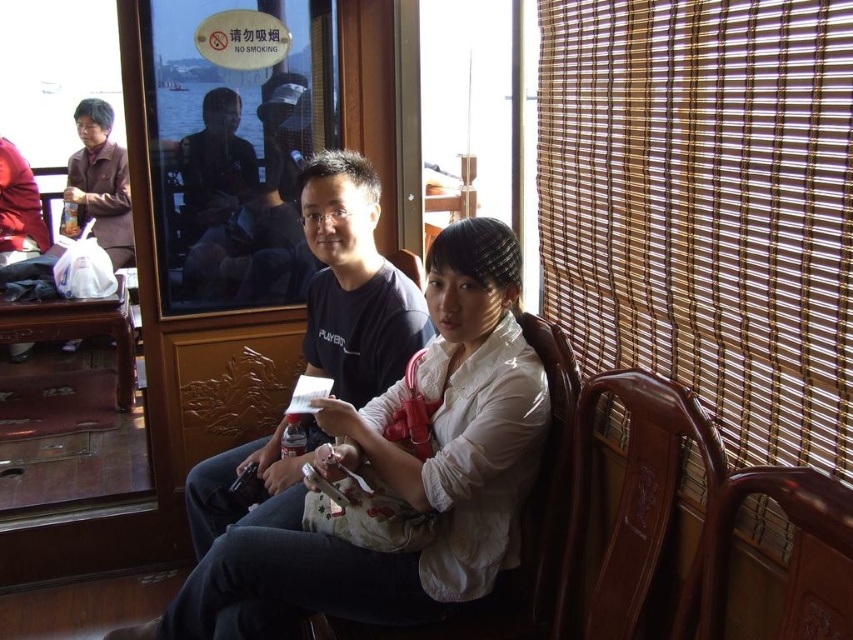
Question: Which object is positioned closest to the brown wooden chair at right?

Choices:
 (A) transparent glass window at upper center
 (B) black matte shirt at center

Answer: (B)

Question: Is black matte shirt at center smaller than brown wooden chair at right?

Choices:
 (A) no
 (B) yes

Answer: (A)

Question: Among these points, which one is farthest from the camera?

Choices:
 (A) (830, 570)
 (B) (550, 566)
 (C) (521, 497)
 (D) (212, 80)

Answer: (D)

Question: Can you confirm if transparent glass window at upper center is smaller than black matte shirt at center?

Choices:
 (A) yes
 (B) no

Answer: (A)

Question: Which point is farther to the camera?

Choices:
 (A) (556, 324)
 (B) (288, 458)
 (C) (840, 512)

Answer: (B)

Question: Observing the image, what is the correct spatial positioning of white matte shirt at center in reference to wooden at right?

Choices:
 (A) left
 (B) right

Answer: (A)